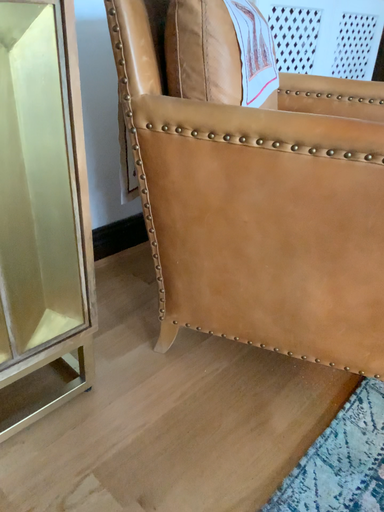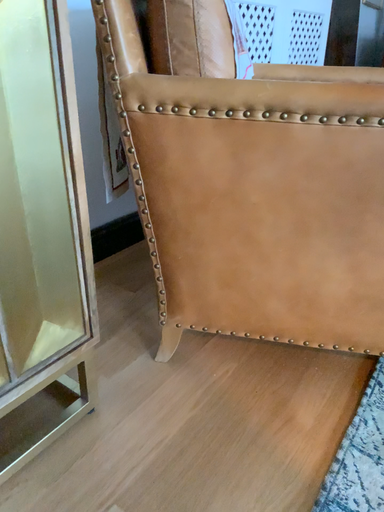
Question: Which way did the camera rotate in the video?

Choices:
 (A) rotated left
 (B) rotated right

Answer: (B)